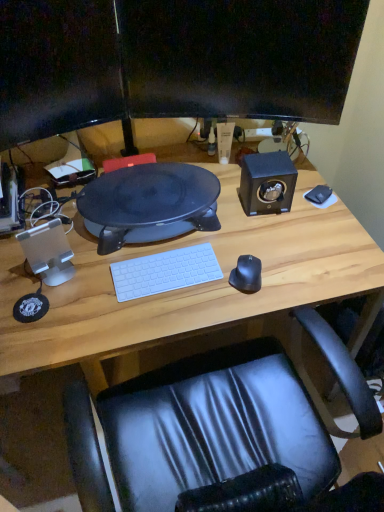
Describe the element at coordinates (57, 68) in the screenshot. I see `matte black monitor at upper center, which is counted as the 2th computer monitor, starting from the right` at that location.

In order to face matte black monitor at upper center, which is counted as the 2th computer monitor, starting from the right, should I rotate leftwards or rightwards?

To align with it, rotate left about 18.598°.

What do you see at coordinates (267, 183) in the screenshot? The width and height of the screenshot is (384, 512). I see `black matte speaker at upper right, marked as the 1th speaker in a back-to-front arrangement` at bounding box center [267, 183].

What is the approximate width of black matte mouse at right?

It is 4.35 inches.

I want to click on black matte mousepad at right, so click(321, 196).

Where is `matte black monitor at upper center, the 1th computer monitor positioned from the left`? The width and height of the screenshot is (384, 512). matte black monitor at upper center, the 1th computer monitor positioned from the left is located at coordinates (57, 68).

Does white matte keyboard at center turn towards matte black monitor at upper center, the 1th computer monitor positioned from the left?

No.

Is the depth of white matte keyboard at center greater than that of matte black monitor at upper center, which is counted as the 2th computer monitor, starting from the right?

That is True.

Consider the image. Is white matte keyboard at center to the left or to the right of matte black monitor at upper center, which is counted as the 2th computer monitor, starting from the right, in the image?

In the image, white matte keyboard at center appears on the right side of matte black monitor at upper center, which is counted as the 2th computer monitor, starting from the right.

What's the angular difference between white matte keyboard at center and matte black monitor at upper center, which is counted as the 2th computer monitor, starting from the right,'s facing directions?

The angle between the facing direction of white matte keyboard at center and the facing direction of matte black monitor at upper center, which is counted as the 2th computer monitor, starting from the right, is 18.8 degrees.

You are a GUI agent. You are given a task and a screenshot of the screen. Output one action in this format:
    pyautogui.click(x=<x>, y=<y>)
    Task: Click on the mouse lying in front of the white matte keyboard at center
    
    Given the screenshot: What is the action you would take?
    pyautogui.click(x=247, y=274)

Based on their positions, is white matte keyboard at center located to the left or right of black matte mouse at right?

white matte keyboard at center is to the left of black matte mouse at right.

Could you tell me if white matte keyboard at center is facing black matte mouse at right?

No, white matte keyboard at center is not facing towards black matte mouse at right.

From the image's perspective, is white matte keyboard at center located above or below black matte mouse at right?

From the image's perspective, white matte keyboard at center appears above black matte mouse at right.

From the image's perspective, which object appears higher, matte black monitor at upper center, the 1th computer monitor positioned from the left, or black matte mousepad at right?

matte black monitor at upper center, the 1th computer monitor positioned from the left, is shown above in the image.

How far apart are matte black monitor at upper center, the 1th computer monitor positioned from the left, and black matte mousepad at right?

The distance of matte black monitor at upper center, the 1th computer monitor positioned from the left, from black matte mousepad at right is 77.61 centimeters.

Considering the relative positions of matte black monitor at upper center, the 1th computer monitor positioned from the left, and black matte mousepad at right in the image provided, is matte black monitor at upper center, the 1th computer monitor positioned from the left, behind black matte mousepad at right?

No, matte black monitor at upper center, the 1th computer monitor positioned from the left, is closer to the camera.

This screenshot has width=384, height=512. What are the coordinates of `computer on the left of black glossy monitor at upper center, the first computer monitor viewed from the right` in the screenshot? It's located at (149, 204).

Is black plastic computer at center turned away from black glossy monitor at upper center, which is the 2th computer monitor from left to right?

No, black glossy monitor at upper center, which is the 2th computer monitor from left to right, is not at the back of black plastic computer at center.

Is black plastic computer at center directly adjacent to black glossy monitor at upper center, the first computer monitor viewed from the right?

No, black plastic computer at center is not next to black glossy monitor at upper center, the first computer monitor viewed from the right.

From the picture: Is black plastic computer at center bigger than black glossy monitor at upper center, which is the 2th computer monitor from left to right?

Yes, black plastic computer at center is bigger than black glossy monitor at upper center, which is the 2th computer monitor from left to right.

Between black plastic computer at center and transparent plastic speaker at left, the second speaker from the back, which one appears on the left side from the viewer's perspective?

Positioned to the left is transparent plastic speaker at left, the second speaker from the back.

Looking at this image, can you confirm if black plastic computer at center is shorter than transparent plastic speaker at left, which is counted as the first speaker, starting from the front?

Indeed, black plastic computer at center has a lesser height compared to transparent plastic speaker at left, which is counted as the first speaker, starting from the front.

Which object is more forward, black plastic computer at center or transparent plastic speaker at left, acting as the 2th speaker starting from the right?

transparent plastic speaker at left, acting as the 2th speaker starting from the right, is closer to the camera.

Is wooden desk at center completely or partially outside of black matte mousepad at right?

Absolutely, wooden desk at center is external to black matte mousepad at right.

Which is behind, point (346, 229) or point (322, 194)?

Point (322, 194)

Is wooden desk at center facing towards black matte mousepad at right?

No, wooden desk at center does not turn towards black matte mousepad at right.

From the image's perspective, is wooden desk at center positioned above or below black matte mousepad at right?

Based on their image positions, wooden desk at center is located beneath black matte mousepad at right.

From a real-world perspective, does black plastic computer at center stand above black matte speaker at upper right, marked as the second speaker in a front-to-back arrangement?

No, from a real-world perspective, black plastic computer at center is not on top of black matte speaker at upper right, marked as the second speaker in a front-to-back arrangement.

The width and height of the screenshot is (384, 512). Find the location of `speaker on the right of black plastic computer at center`. speaker on the right of black plastic computer at center is located at coordinates (267, 183).

Which object is more forward, black plastic computer at center or black matte speaker at upper right, positioned as the 2th speaker in left-to-right order?

Answer: black plastic computer at center is more forward.

At what (x,y) coordinates should I click in order to perform the action: click on computer monitor located on the left of white matte keyboard at center. Please return your answer as a coordinate pair (x, y). Looking at the image, I should click on (57, 68).

Image resolution: width=384 pixels, height=512 pixels. In order to click on computer keyboard that is above the black matte mouse at right (from the image's perspective) in this screenshot , I will do `click(165, 272)`.

Considering their positions, is transparent plastic speaker at left, acting as the 2th speaker starting from the right, positioned closer to matte black monitor at upper center, the 1th computer monitor positioned from the left, than black matte mousepad at right?

transparent plastic speaker at left, acting as the 2th speaker starting from the right, lies closer to matte black monitor at upper center, the 1th computer monitor positioned from the left, than the other object.

From the image, which object appears to be nearer to transparent plastic speaker at left, acting as the 1th speaker starting from the left, white matte keyboard at center or black plastic computer at center?

white matte keyboard at center is closer to transparent plastic speaker at left, acting as the 1th speaker starting from the left.

Based on their spatial positions, is white matte keyboard at center or black plastic computer at center closer to matte black monitor at upper center, the 1th computer monitor positioned from the left?

black plastic computer at center.

When comparing their distances from matte black monitor at upper center, the 1th computer monitor positioned from the left, does black glossy monitor at upper center, which is the 2th computer monitor from left to right, or white matte keyboard at center seem closer?

The object closer to matte black monitor at upper center, the 1th computer monitor positioned from the left, is black glossy monitor at upper center, which is the 2th computer monitor from left to right.

Estimate the real-world distances between objects in this image. Which object is closer to wooden desk at center, black matte mousepad at right or black matte speaker at upper right, the 1th speaker positioned from the right?

black matte speaker at upper right, the 1th speaker positioned from the right.

When comparing their distances from wooden desk at center, does black matte mousepad at right or black glossy monitor at upper center, the first computer monitor viewed from the right, seem further?

black matte mousepad at right is positioned further to the anchor wooden desk at center.

Looking at the image, which one is located closer to wooden desk at center, transparent plastic speaker at left, which is counted as the first speaker, starting from the front, or black plastic computer at center?

The object closer to wooden desk at center is black plastic computer at center.

Considering their positions, is matte black monitor at upper center, which is counted as the 2th computer monitor, starting from the right, positioned further to white matte keyboard at center than black glossy monitor at upper center, which is the 2th computer monitor from left to right?

black glossy monitor at upper center, which is the 2th computer monitor from left to right.

You are a GUI agent. You are given a task and a screenshot of the screen. Output one action in this format:
    pyautogui.click(x=<x>, y=<y>)
    Task: Click on the mouse between matte black monitor at upper center, the 1th computer monitor positioned from the left, and wooden desk at center, in the vertical direction
    The height and width of the screenshot is (512, 384).
    Given the screenshot: What is the action you would take?
    pyautogui.click(x=247, y=274)

This screenshot has width=384, height=512. What are the coordinates of `computer keyboard between matte black monitor at upper center, the 1th computer monitor positioned from the left, and wooden desk at center in the up-down direction` in the screenshot? It's located at (165, 272).

Identify the location of mousepad between black matte speaker at upper right, positioned as the 2th speaker in left-to-right order, and black matte mouse at right in the up-down direction. This screenshot has width=384, height=512. 321,196.

Where is `speaker between black glossy monitor at upper center, which is the 2th computer monitor from left to right, and black matte mousepad at right in the up-down direction`? speaker between black glossy monitor at upper center, which is the 2th computer monitor from left to right, and black matte mousepad at right in the up-down direction is located at coordinates (267, 183).